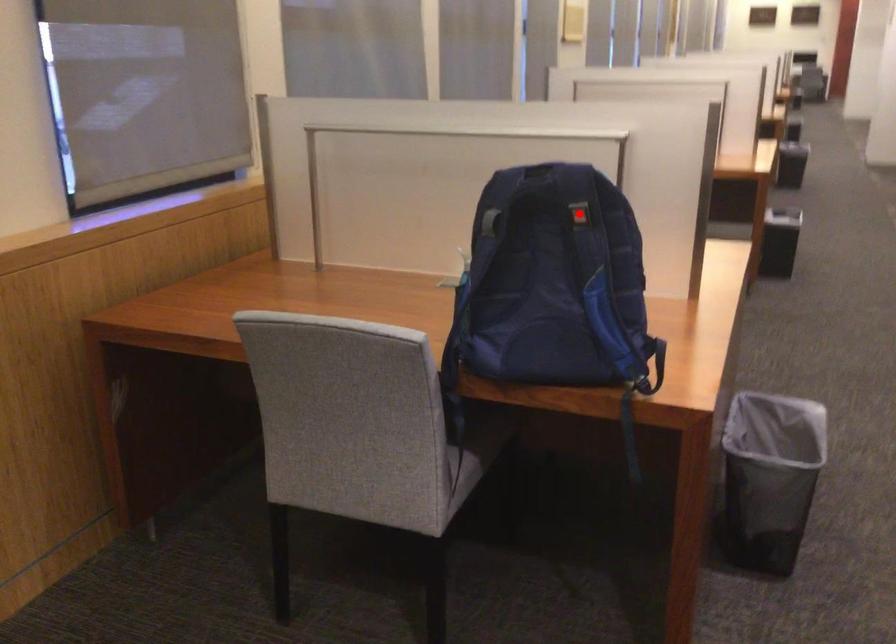
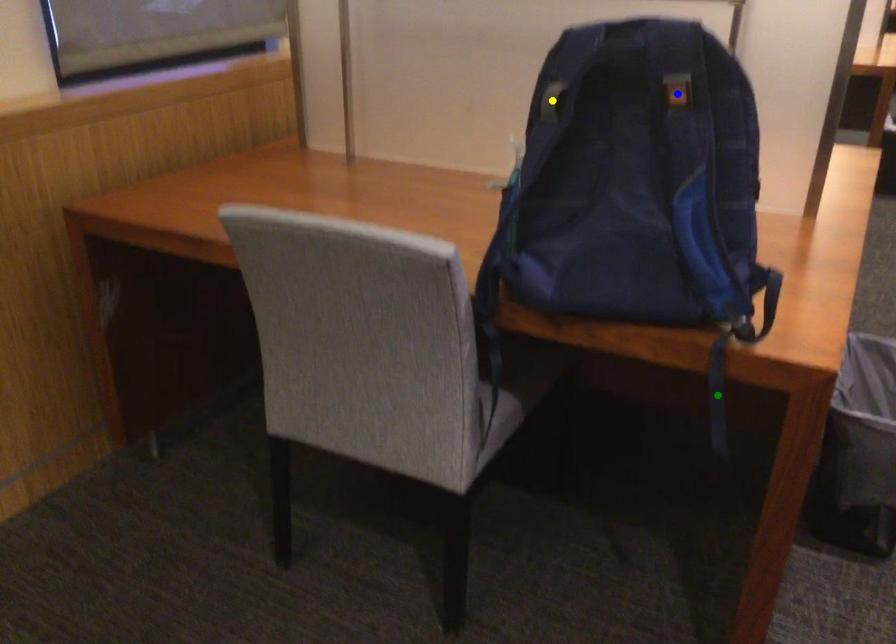
Question: I am providing you with two images of the same scene from different viewpoints. A red point is marked on the first image. You are given multiple points on the second image. Which point in image 2 represents the same 3d spot as the red point in image 1?

Choices:
 (A) green point
 (B) blue point
 (C) yellow point

Answer: (B)